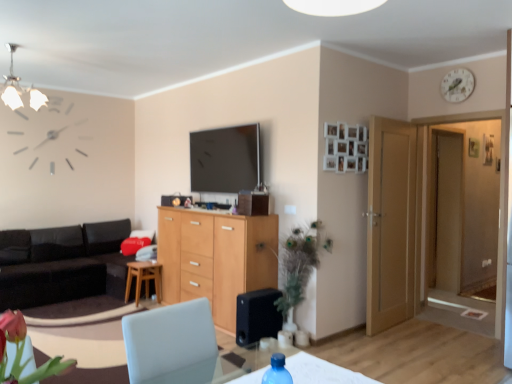
Question: Does transparent plastic water bottle at lower center appear on the right side of black leather couch at left?

Choices:
 (A) yes
 (B) no

Answer: (A)

Question: Considering the relative sizes of transparent plastic water bottle at lower center and black leather couch at left in the image provided, is transparent plastic water bottle at lower center thinner than black leather couch at left?

Choices:
 (A) no
 (B) yes

Answer: (B)

Question: Does transparent plastic water bottle at lower center appear on the left side of black leather couch at left?

Choices:
 (A) yes
 (B) no

Answer: (B)

Question: Can you confirm if transparent plastic water bottle at lower center is shorter than black leather couch at left?

Choices:
 (A) yes
 (B) no

Answer: (A)

Question: Does transparent plastic water bottle at lower center have a larger size compared to black leather couch at left?

Choices:
 (A) no
 (B) yes

Answer: (A)

Question: Are transparent plastic water bottle at lower center and black leather couch at left making contact?

Choices:
 (A) yes
 (B) no

Answer: (B)

Question: Is wooden door at right closer to camera compared to transparent plastic water bottle at lower center?

Choices:
 (A) yes
 (B) no

Answer: (B)

Question: Does wooden door at right have a larger size compared to transparent plastic water bottle at lower center?

Choices:
 (A) no
 (B) yes

Answer: (B)

Question: Does wooden door at right turn towards transparent plastic water bottle at lower center?

Choices:
 (A) no
 (B) yes

Answer: (A)

Question: From a real-world perspective, is wooden door at right under transparent plastic water bottle at lower center?

Choices:
 (A) yes
 (B) no

Answer: (B)

Question: From a real-world perspective, is wooden door at right positioned over transparent plastic water bottle at lower center based on gravity?

Choices:
 (A) no
 (B) yes

Answer: (B)

Question: Considering the relative sizes of wooden door at right and transparent plastic water bottle at lower center in the image provided, is wooden door at right taller than transparent plastic water bottle at lower center?

Choices:
 (A) yes
 (B) no

Answer: (A)

Question: Is black matte speaker at lower center smaller than transparent glass door at right?

Choices:
 (A) yes
 (B) no

Answer: (A)